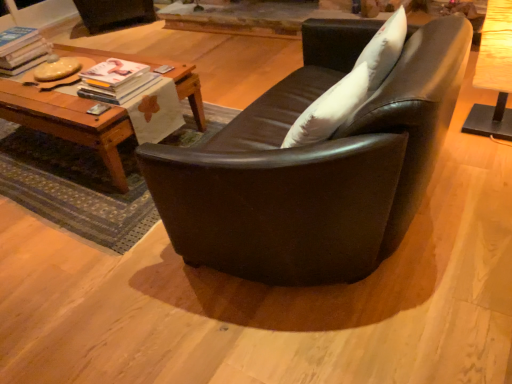
Question: Considering the positions of matte white magazine at upper left, the 1th magazine when ordered from top to bottom, and matte white magazine at center left, arranged as the second magazine when viewed from the left, in the image, is matte white magazine at upper left, the 1th magazine when ordered from top to bottom, wider or thinner than matte white magazine at center left, arranged as the second magazine when viewed from the left,?

Choices:
 (A) wide
 (B) thin

Answer: (A)

Question: From a real-world perspective, is matte white magazine at upper left, which is counted as the 2th magazine, starting from the front, positioned above or below matte white magazine at center left, which ranks as the first magazine in front-to-back order?

Choices:
 (A) below
 (B) above

Answer: (B)

Question: Which of these objects is positioned farthest from the woodenwoodentable at left, which is the 1th table in left-to-right order?

Choices:
 (A) wooden table at right, the 2th table viewed from the left
 (B) matte white magazine at center left, the 1th magazine positioned from the bottom
 (C) white soft pillow at upper right
 (D) matte black couch at center
 (E) matte white magazine at upper left, the 1th magazine when ordered from top to bottom

Answer: (A)

Question: Which is farther from the white soft pillow at upper right?

Choices:
 (A) matte white magazine at upper left, positioned as the second magazine in bottom-to-top order
 (B) woodenwoodentable at left, placed as the 2th table when sorted from right to left
 (C) matte black couch at center
 (D) wooden table at right, acting as the 1th table starting from the right
 (E) matte white magazine at center left, which ranks as the first magazine in front-to-back order

Answer: (A)